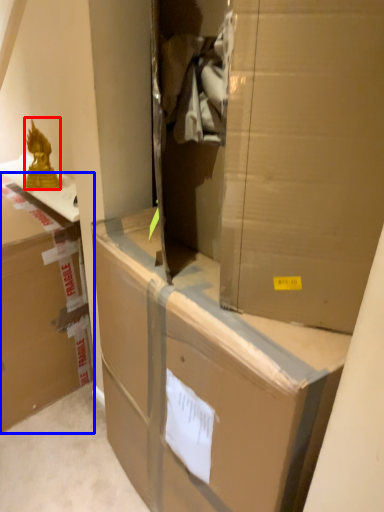
Question: Which object appears closest to the camera in this image, wrap (highlighted by a red box) or box (highlighted by a blue box)?

Choices:
 (A) wrap
 (B) box

Answer: (B)